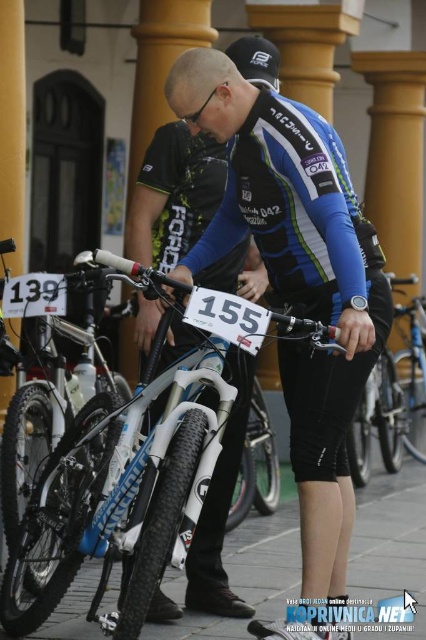
Is blue/white jersey at center to the right of white matte bicycle at center from the viewer's perspective?

Correct, you'll find blue/white jersey at center to the right of white matte bicycle at center.

Is blue/white jersey at center shorter than white matte bicycle at center?

In fact, blue/white jersey at center may be taller than white matte bicycle at center.

Identify the location of blue/white jersey at center. Image resolution: width=426 pixels, height=640 pixels. (296, 278).

From the picture: Who is shorter, blue/white jersey at center or shiny silver bike at center?

blue/white jersey at center is shorter.

Does blue/white jersey at center lie in front of shiny silver bike at center?

Yes, it is.

Who is more forward, (322,509) or (422,440)?

Point (322,509) is in front.

This screenshot has width=426, height=640. In order to click on blue/white jersey at center in this screenshot , I will do `click(296, 278)`.

Between white matte bicycle at center and shiny silver bike at center, which one appears on the left side from the viewer's perspective?

From the viewer's perspective, white matte bicycle at center appears more on the left side.

Which is in front, point (115, 275) or point (417, 346)?

Point (115, 275)

You are a GUI agent. You are given a task and a screenshot of the screen. Output one action in this format:
    pyautogui.click(x=<x>, y=<y>)
    Task: Click on the white matte bicycle at center
    
    Given the screenshot: What is the action you would take?
    pyautogui.click(x=121, y=490)